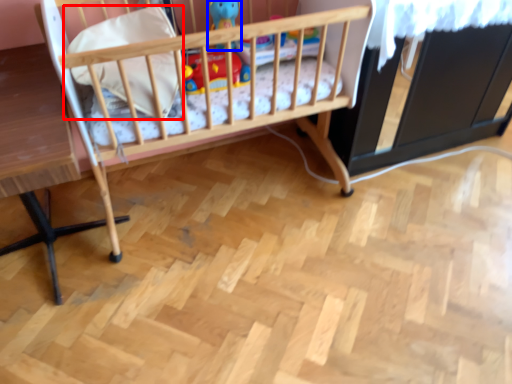
Question: Which object appears farthest to the camera in this image, pillow (highlighted by a red box) or toy (highlighted by a blue box)?

Choices:
 (A) pillow
 (B) toy

Answer: (B)